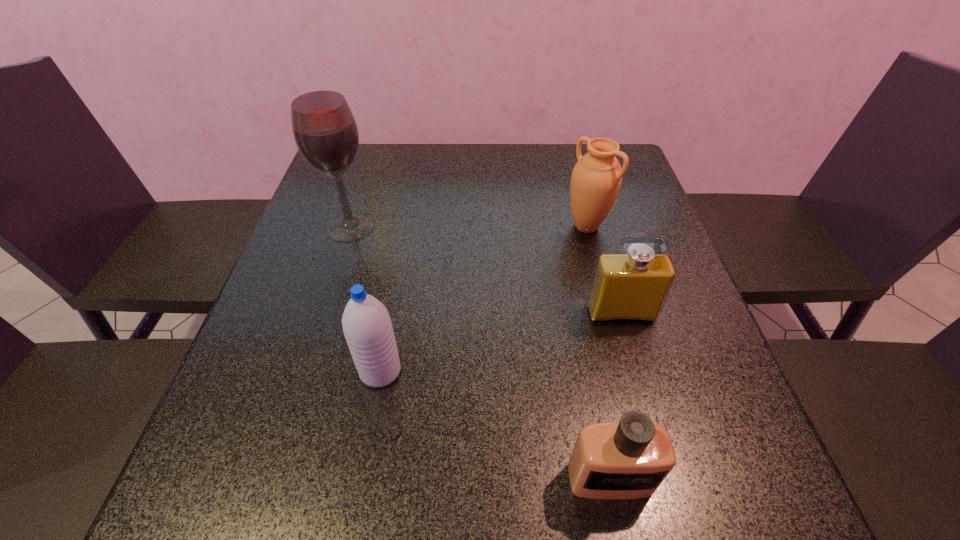
Find the location of a particular element. The image size is (960, 540). vacant position located 0.180m on the right of the water bottle is located at coordinates (499, 371).

The image size is (960, 540). I want to click on free space located on the front-facing side of the farther perfume, so click(654, 430).

Where is `object at the near edge`? object at the near edge is located at coordinates (629, 459).

Image resolution: width=960 pixels, height=540 pixels. In order to click on object present at the left edge in this screenshot , I will do `click(325, 131)`.

You are a GUI agent. You are given a task and a screenshot of the screen. Output one action in this format:
    pyautogui.click(x=<x>, y=<y>)
    Task: Click on the urn at the right edge
    The height and width of the screenshot is (540, 960).
    Given the screenshot: What is the action you would take?
    pyautogui.click(x=596, y=179)

This screenshot has height=540, width=960. I want to click on perfume that is at the right edge, so click(627, 287).

Locate an element on the screen. free location at the far edge of the desktop is located at coordinates (521, 176).

The image size is (960, 540). In order to click on vacant space at the left edge of the desktop in this screenshot , I will do click(x=246, y=390).

At what (x,y) coordinates should I click in order to perform the action: click on vacant region at the right edge of the desktop. Please return your answer as a coordinate pair (x, y). The image size is (960, 540). Looking at the image, I should click on (732, 445).

This screenshot has width=960, height=540. I want to click on free space at the near left corner, so click(209, 498).